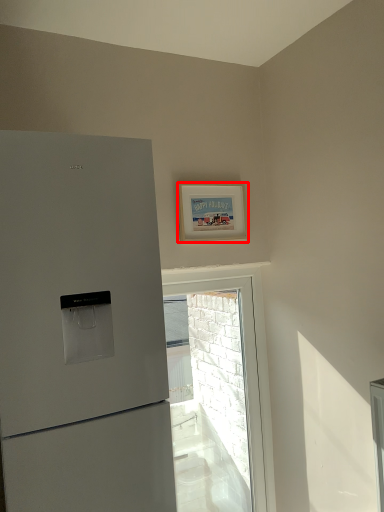
Question: Considering the relative positions of picture frame (annotated by the red box) and window in the image provided, where is picture frame (annotated by the red box) located with respect to the staircase?

Choices:
 (A) left
 (B) right

Answer: (A)